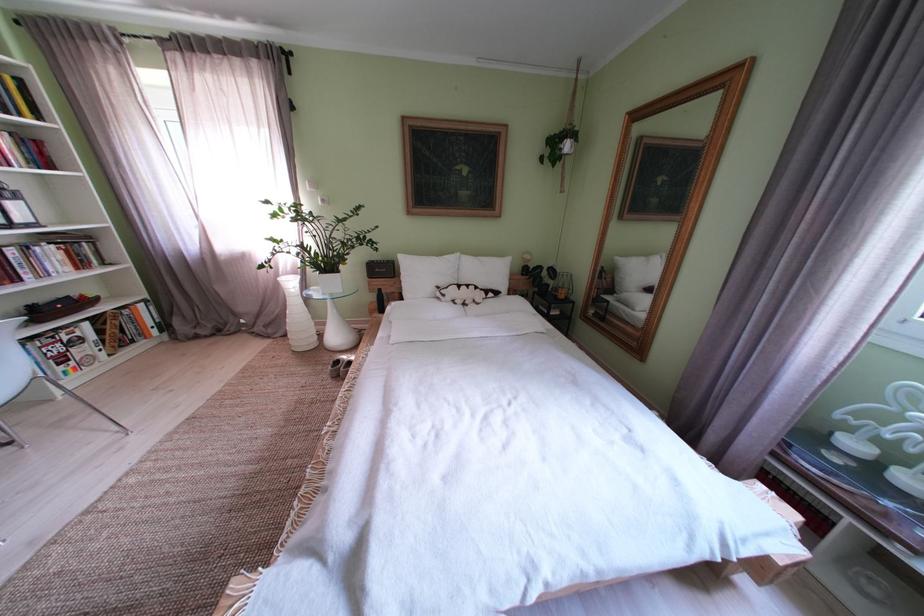
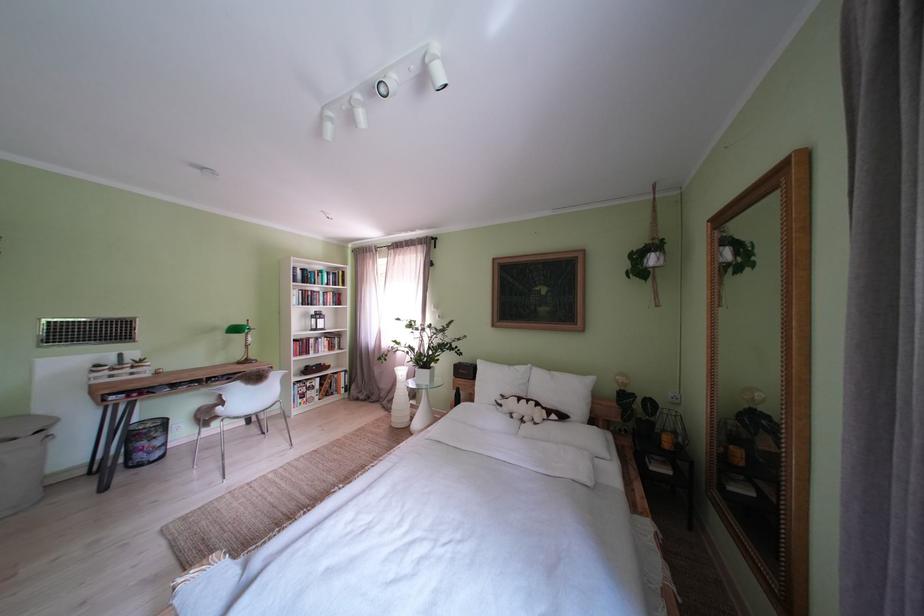
In the second image, find the point that corresponds to (469,259) in the first image.

(541, 371)